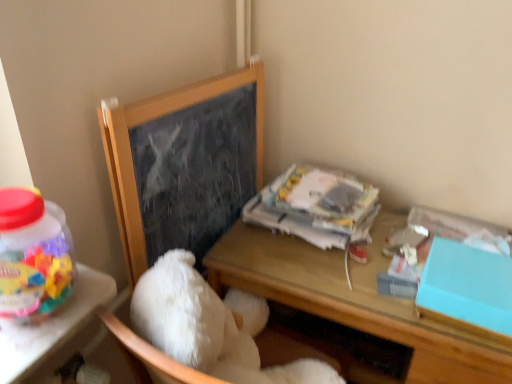
Question: Can you confirm if white fluffy teddy bear at center is bigger than wooden chalkboard at upper left?

Choices:
 (A) yes
 (B) no

Answer: (A)

Question: Is white fluffy teddy bear at center to the right of wooden chalkboard at upper left from the viewer's perspective?

Choices:
 (A) no
 (B) yes

Answer: (B)

Question: Is white fluffy teddy bear at center outside of wooden chalkboard at upper left?

Choices:
 (A) no
 (B) yes

Answer: (B)

Question: Is white fluffy teddy bear at center oriented towards wooden chalkboard at upper left?

Choices:
 (A) yes
 (B) no

Answer: (B)

Question: Would you consider white fluffy teddy bear at center to be distant from wooden chalkboard at upper left?

Choices:
 (A) yes
 (B) no

Answer: (B)

Question: From the image's perspective, relative to teal matte box at right, is wooden desk at center above or below?

Choices:
 (A) above
 (B) below

Answer: (B)

Question: Which is correct: wooden desk at center is inside teal matte box at right, or outside of it?

Choices:
 (A) outside
 (B) inside

Answer: (A)

Question: Is wooden desk at center to the left or to the right of teal matte box at right in the image?

Choices:
 (A) left
 (B) right

Answer: (A)

Question: Considering the positions of wooden desk at center and teal matte box at right in the image, is wooden desk at center bigger or smaller than teal matte box at right?

Choices:
 (A) small
 (B) big

Answer: (B)

Question: Would you say white fluffy teddy bear at center is inside or outside wooden chalkboard at upper left?

Choices:
 (A) outside
 (B) inside

Answer: (A)

Question: Looking at the image, does white fluffy teddy bear at center seem bigger or smaller compared to wooden chalkboard at upper left?

Choices:
 (A) small
 (B) big

Answer: (B)

Question: From a real-world perspective, is white fluffy teddy bear at center positioned above or below wooden chalkboard at upper left?

Choices:
 (A) above
 (B) below

Answer: (B)

Question: Is point [284, 370] closer or farther from the camera than point [200, 187]?

Choices:
 (A) farther
 (B) closer

Answer: (B)

Question: Is teal matte box at right bigger or smaller than white paper at upper right?

Choices:
 (A) small
 (B) big

Answer: (A)

Question: From a real-world perspective, is teal matte box at right above or below white paper at upper right?

Choices:
 (A) above
 (B) below

Answer: (B)